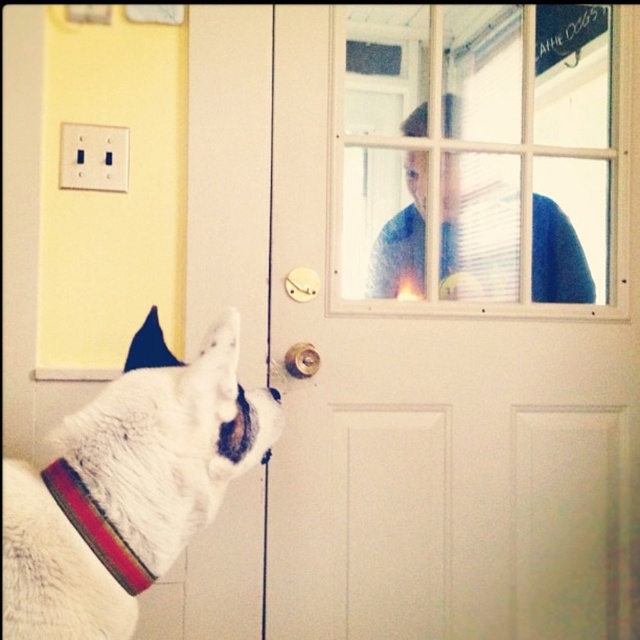
Is clear glass window at upper center further to the viewer compared to multicolored woven band at lower left?

Yes, it is behind multicolored woven band at lower left.

Who is higher up, clear glass window at upper center or multicolored woven band at lower left?

Positioned higher is clear glass window at upper center.

Where is `clear glass window at upper center`? clear glass window at upper center is located at coordinates (454, 164).

Is clear glass window at upper center below white fur collar at lower left?

Actually, clear glass window at upper center is above white fur collar at lower left.

Is point (516, 316) closer to viewer compared to point (243, 452)?

No.

Who is more forward, (616, 157) or (264, 424)?

Point (264, 424) is more forward.

You are a GUI agent. You are given a task and a screenshot of the screen. Output one action in this format:
    pyautogui.click(x=<x>, y=<y>)
    Task: Click on the clear glass window at upper center
    The image size is (640, 640).
    Given the screenshot: What is the action you would take?
    [x=454, y=164]

Can you confirm if white matte screen door at center is positioned to the left of gold metallic door handle at center?

No, white matte screen door at center is not to the left of gold metallic door handle at center.

Is white matte screen door at center wider than gold metallic door handle at center?

Correct, the width of white matte screen door at center exceeds that of gold metallic door handle at center.

Which is in front, point (609, 74) or point (288, 369)?

Point (288, 369) is more forward.

Find the location of a particular element. white matte screen door at center is located at coordinates (422, 317).